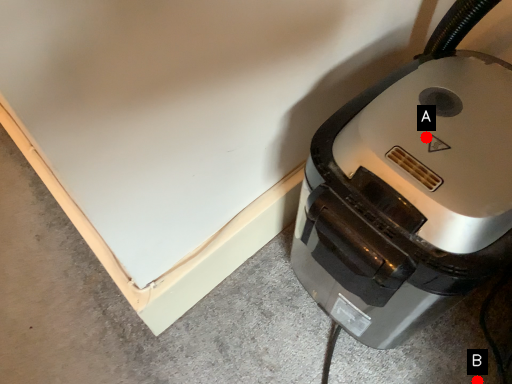
Question: Two points are circled on the image, labeled by A and B beside each circle. Among these points, which one is farthest from the camera?

Choices:
 (A) A is further
 (B) B is further

Answer: (B)